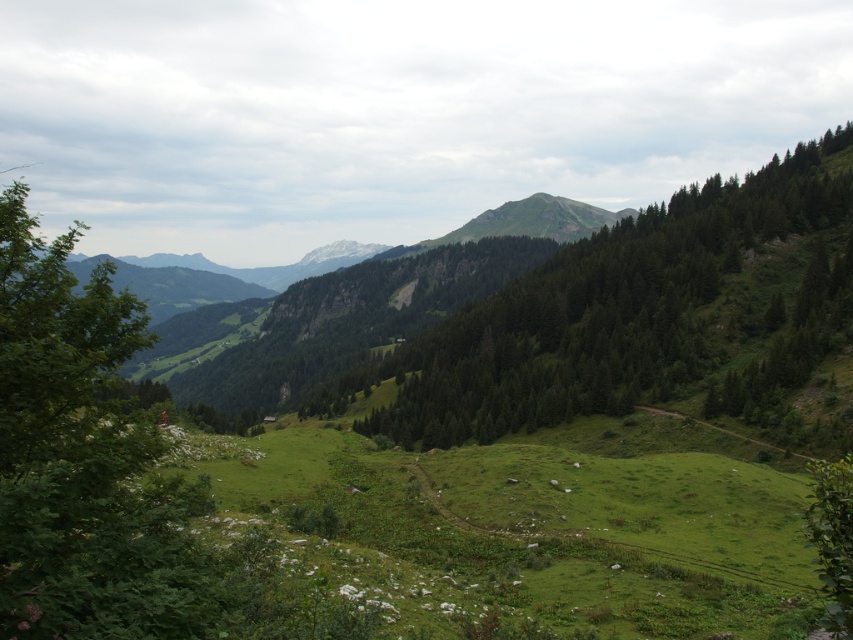
Does green grassy field at center have a larger size compared to green textured tree at center?

Incorrect, green grassy field at center is not larger than green textured tree at center.

Measure the distance between green grassy field at center and camera.

green grassy field at center is 25.74 meters away from camera.

This screenshot has height=640, width=853. I want to click on green grassy field at center, so click(531, 531).

Can you confirm if green textured tree at center is wider than green leafy tree at left?

Yes, green textured tree at center is wider than green leafy tree at left.

Is green textured tree at center behind green leafy tree at left?

Yes, it is behind green leafy tree at left.

At what (x,y) coordinates should I click in order to perform the action: click on green textured tree at center. Please return your answer as a coordinate pair (x, y). The height and width of the screenshot is (640, 853). Looking at the image, I should click on (637, 316).

Is green grassy field at center below green leafy tree at left?

Yes.

Looking at this image, is green grassy field at center thinner than green leafy tree at left?

Incorrect, green grassy field at center's width is not less than green leafy tree at left's.

Is point (427, 452) farther from camera compared to point (65, 248)?

Yes.

Locate an element on the screen. The height and width of the screenshot is (640, 853). green grassy field at center is located at coordinates (531, 531).